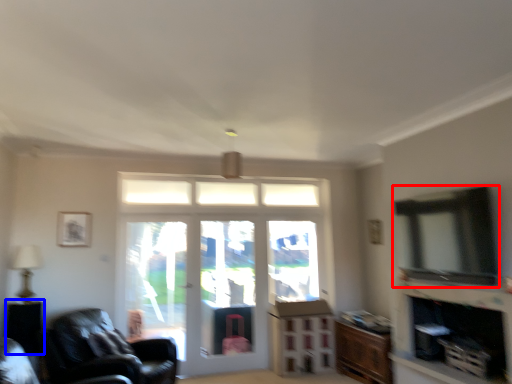
Question: Which of the following is the farthest to the observer, window (highlighted by a red box) or side table (highlighted by a blue box)?

Choices:
 (A) window
 (B) side table

Answer: (B)